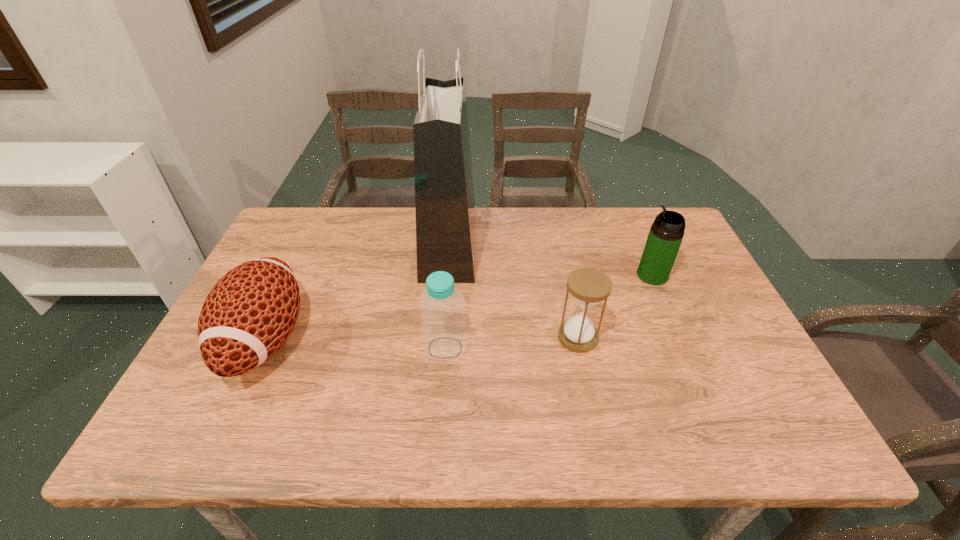
You are a GUI agent. You are given a task and a screenshot of the screen. Output one action in this format:
    pyautogui.click(x=<x>, y=<y>)
    Task: Click on the vacant point that satisfies the following two spatial constraints: 1. on the front with handles of the shopping bag; 2. on the left side of the hourglass
    The image size is (960, 540).
    Given the screenshot: What is the action you would take?
    click(442, 338)